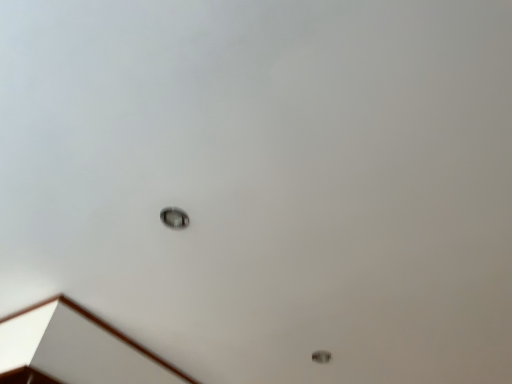
Question: Is metallic circular light fixture at center not within metallic ring at lower right?

Choices:
 (A) no
 (B) yes

Answer: (B)

Question: Does metallic circular light fixture at center have a lesser height compared to metallic ring at lower right?

Choices:
 (A) no
 (B) yes

Answer: (A)

Question: Can you confirm if metallic circular light fixture at center is wider than metallic ring at lower right?

Choices:
 (A) yes
 (B) no

Answer: (A)

Question: Is metallic circular light fixture at center thinner than metallic ring at lower right?

Choices:
 (A) yes
 (B) no

Answer: (B)

Question: Considering the relative positions of metallic circular light fixture at center and metallic ring at lower right in the image provided, is metallic circular light fixture at center to the right of metallic ring at lower right from the viewer's perspective?

Choices:
 (A) yes
 (B) no

Answer: (B)

Question: Would you consider metallic circular light fixture at center to be distant from metallic ring at lower right?

Choices:
 (A) yes
 (B) no

Answer: (B)

Question: From the image's perspective, is metallic ring at lower right on top of metallic circular light fixture at center?

Choices:
 (A) yes
 (B) no

Answer: (B)

Question: Can you confirm if metallic ring at lower right is bigger than metallic circular light fixture at center?

Choices:
 (A) yes
 (B) no

Answer: (B)

Question: Considering the relative positions of metallic ring at lower right and metallic circular light fixture at center in the image provided, is metallic ring at lower right behind metallic circular light fixture at center?

Choices:
 (A) no
 (B) yes

Answer: (B)

Question: Can you confirm if metallic ring at lower right is shorter than metallic circular light fixture at center?

Choices:
 (A) yes
 (B) no

Answer: (A)

Question: Is metallic ring at lower right closer to camera compared to metallic circular light fixture at center?

Choices:
 (A) yes
 (B) no

Answer: (B)

Question: Is metallic ring at lower right aimed at metallic circular light fixture at center?

Choices:
 (A) yes
 (B) no

Answer: (A)

Question: Which is correct: metallic ring at lower right is inside metallic circular light fixture at center, or outside of it?

Choices:
 (A) inside
 (B) outside

Answer: (B)